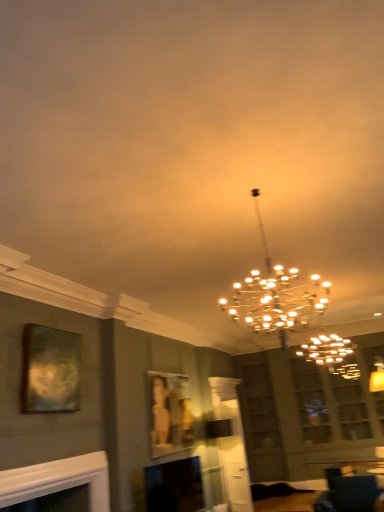
Question: Can you confirm if white glossy fireplace at lower left, arranged as the second fireplace when viewed from the right, is taller than metallic gold chandelier at center?

Choices:
 (A) yes
 (B) no

Answer: (B)

Question: From a real-world perspective, is white glossy fireplace at lower left, arranged as the 1th fireplace when viewed from the front, positioned under metallic gold chandelier at center based on gravity?

Choices:
 (A) no
 (B) yes

Answer: (B)

Question: Is the depth of white glossy fireplace at lower left, the 1th fireplace when ordered from left to right, less than that of metallic gold chandelier at center?

Choices:
 (A) no
 (B) yes

Answer: (A)

Question: Is white glossy fireplace at lower left, the second fireplace viewed from the back, at the left side of metallic gold chandelier at center?

Choices:
 (A) yes
 (B) no

Answer: (A)

Question: Does white glossy fireplace at lower left, arranged as the 1th fireplace when viewed from the front, contain metallic gold chandelier at center?

Choices:
 (A) no
 (B) yes

Answer: (A)

Question: Choose the correct answer: Is velvet dark blue sofa at lower right inside matte black fireplace at lower left, which is the first fireplace in right-to-left order, or outside it?

Choices:
 (A) inside
 (B) outside

Answer: (B)

Question: In the image, is velvet dark blue sofa at lower right on the left side or the right side of matte black fireplace at lower left, the 1th fireplace positioned from the back?

Choices:
 (A) left
 (B) right

Answer: (B)

Question: Relative to matte black fireplace at lower left, the 1th fireplace positioned from the back, is velvet dark blue sofa at lower right in front or behind?

Choices:
 (A) behind
 (B) front

Answer: (B)

Question: From the image's perspective, relative to matte black fireplace at lower left, the second fireplace when ordered from left to right, is velvet dark blue sofa at lower right above or below?

Choices:
 (A) above
 (B) below

Answer: (B)

Question: Considering the relative positions of metallic gold picture frame at upper left, positioned as the second picture frame in right-to-left order, and matte gold picture frame at center, which appears as the second picture frame when viewed from the top, in the image provided, is metallic gold picture frame at upper left, positioned as the second picture frame in right-to-left order, to the left or to the right of matte gold picture frame at center, which appears as the second picture frame when viewed from the top,?

Choices:
 (A) right
 (B) left

Answer: (B)

Question: Looking at their shapes, would you say metallic gold picture frame at upper left, positioned as the second picture frame in right-to-left order, is wider or thinner than matte gold picture frame at center, placed as the first picture frame when sorted from bottom to top?

Choices:
 (A) wide
 (B) thin

Answer: (A)

Question: From a real-world perspective, relative to matte gold picture frame at center, placed as the first picture frame when sorted from bottom to top, is metallic gold picture frame at upper left, positioned as the second picture frame in right-to-left order, vertically above or below?

Choices:
 (A) below
 (B) above

Answer: (B)

Question: From the image's perspective, is metallic gold picture frame at upper left, positioned as the second picture frame in right-to-left order, above or below matte gold picture frame at center, which appears as the second picture frame when viewed from the top?

Choices:
 (A) above
 (B) below

Answer: (A)

Question: Is white glossy fireplace at lower left, arranged as the second fireplace when viewed from the right, inside or outside of velvet dark blue sofa at lower right?

Choices:
 (A) outside
 (B) inside

Answer: (A)

Question: Considering their positions, is white glossy fireplace at lower left, arranged as the second fireplace when viewed from the right, located in front of or behind velvet dark blue sofa at lower right?

Choices:
 (A) behind
 (B) front

Answer: (B)